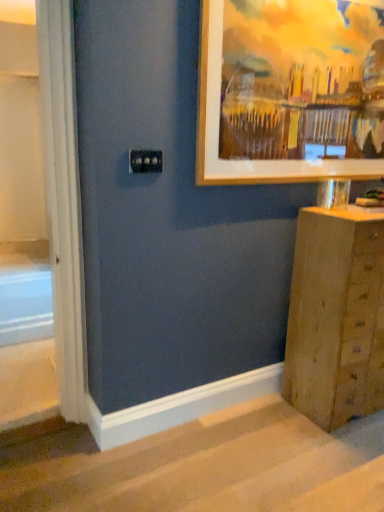
Question: Is wooden chest of drawers at lower right oriented towards wooden frame at upper right?

Choices:
 (A) yes
 (B) no

Answer: (B)

Question: Is wooden chest of drawers at lower right bigger than wooden frame at upper right?

Choices:
 (A) yes
 (B) no

Answer: (A)

Question: Considering the relative sizes of wooden chest of drawers at lower right and wooden frame at upper right in the image provided, is wooden chest of drawers at lower right shorter than wooden frame at upper right?

Choices:
 (A) yes
 (B) no

Answer: (B)

Question: Is wooden chest of drawers at lower right far away from wooden frame at upper right?

Choices:
 (A) no
 (B) yes

Answer: (A)

Question: Is wooden chest of drawers at lower right closer to the viewer compared to wooden frame at upper right?

Choices:
 (A) yes
 (B) no

Answer: (B)

Question: Is wooden chest of drawers at lower right in front of or behind wooden frame at upper right in the image?

Choices:
 (A) front
 (B) behind

Answer: (B)

Question: Looking at their shapes, would you say wooden chest of drawers at lower right is wider or thinner than wooden frame at upper right?

Choices:
 (A) thin
 (B) wide

Answer: (B)

Question: In terms of height, does wooden chest of drawers at lower right look taller or shorter compared to wooden frame at upper right?

Choices:
 (A) short
 (B) tall

Answer: (B)

Question: Is wooden chest of drawers at lower right bigger or smaller than wooden frame at upper right?

Choices:
 (A) big
 (B) small

Answer: (A)

Question: Considering the positions of point (302, 382) and point (168, 493), is point (302, 382) closer or farther from the camera than point (168, 493)?

Choices:
 (A) farther
 (B) closer

Answer: (A)

Question: Is wooden chest of drawers at lower right situated inside carpeted stairs at lower center or outside?

Choices:
 (A) outside
 (B) inside

Answer: (A)

Question: From a real-world perspective, is wooden chest of drawers at lower right positioned above or below carpeted stairs at lower center?

Choices:
 (A) above
 (B) below

Answer: (A)

Question: Based on their sizes in the image, would you say wooden chest of drawers at lower right is bigger or smaller than carpeted stairs at lower center?

Choices:
 (A) big
 (B) small

Answer: (A)

Question: Considering the positions of point (173, 482) and point (304, 338), is point (173, 482) closer or farther from the camera than point (304, 338)?

Choices:
 (A) farther
 (B) closer

Answer: (B)

Question: Do you think carpeted stairs at lower center is within wooden chest of drawers at lower right, or outside of it?

Choices:
 (A) inside
 (B) outside

Answer: (B)